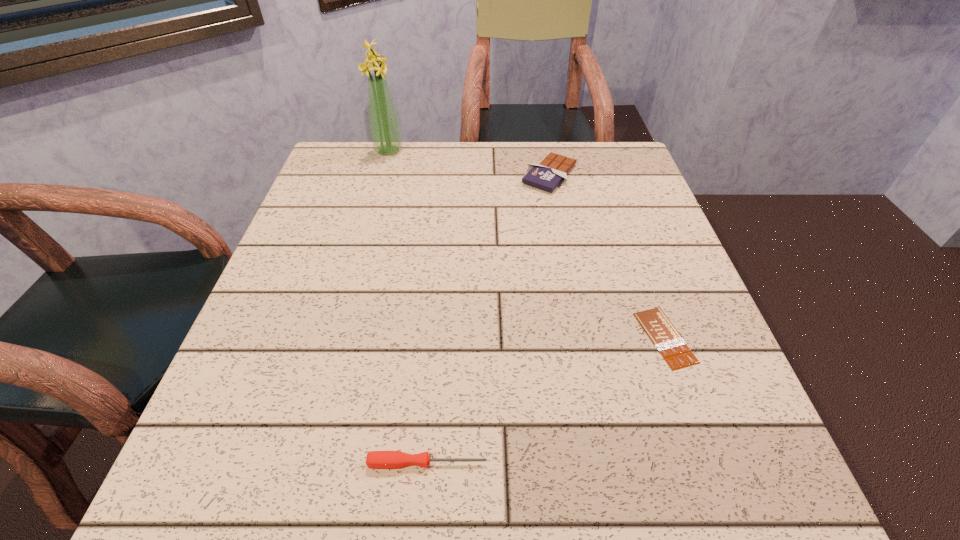
You are a GUI agent. You are given a task and a screenshot of the screen. Output one action in this format:
    pyautogui.click(x=<x>, y=<y>)
    Task: Click on the vacant space that satisfies the following two spatial constraints: 1. on the front-facing side of the taller chocolate bar; 2. on the right side of the bouquet
    
    Given the screenshot: What is the action you would take?
    pyautogui.click(x=382, y=175)

Find the location of `vacant region that satisfies the following two spatial constraints: 1. on the front-facing side of the right chocolate bar; 2. on the left side of the bouquet`. vacant region that satisfies the following two spatial constraints: 1. on the front-facing side of the right chocolate bar; 2. on the left side of the bouquet is located at coordinates (337, 338).